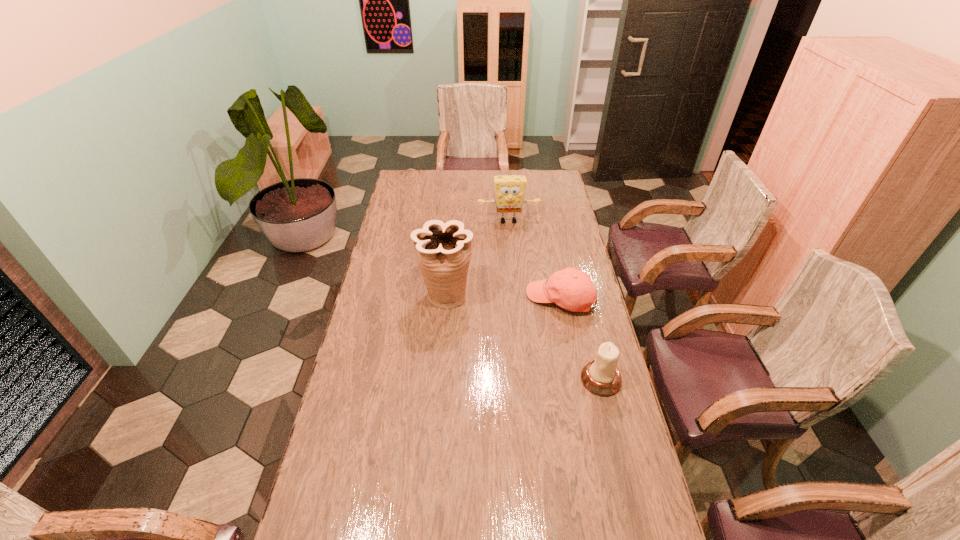
The width and height of the screenshot is (960, 540). Find the location of `vacant region located 0.390m on the front-facing side of the baseball cap`. vacant region located 0.390m on the front-facing side of the baseball cap is located at coordinates (448, 356).

This screenshot has height=540, width=960. I want to click on vacant area situated 0.110m on the front-facing side of the baseball cap, so click(512, 322).

Where is `vacant space located 0.330m on the face of the sponge`? The width and height of the screenshot is (960, 540). vacant space located 0.330m on the face of the sponge is located at coordinates (516, 273).

Locate an element on the screen. vacant space situated on the face of the sponge is located at coordinates (512, 246).

The height and width of the screenshot is (540, 960). What are the coordinates of `free space located 0.100m on the face of the sponge` in the screenshot? It's located at (512, 240).

I want to click on candle holder that is at the right edge, so click(x=601, y=376).

Find the location of a particular element. Image resolution: width=960 pixels, height=540 pixels. baseball cap at the right edge is located at coordinates (572, 289).

In the image, there is a desktop. Where is `vacant space at the far edge`? vacant space at the far edge is located at coordinates (488, 183).

The image size is (960, 540). In the image, there is a desktop. What are the coordinates of `free space at the near edge` in the screenshot? It's located at (421, 506).

Find the location of a particular element. The width and height of the screenshot is (960, 540). free region at the left edge of the desktop is located at coordinates (342, 475).